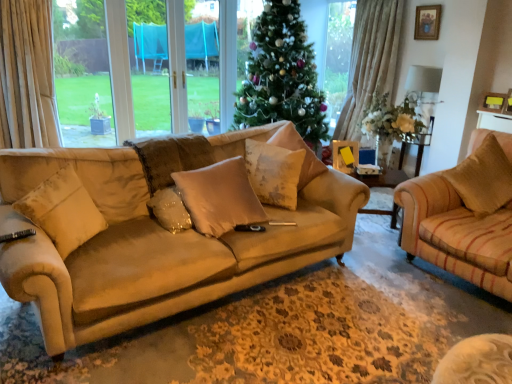
At what (x,y) coordinates should I click in order to perform the action: click on blank space above suede beige couch at center (from a real-world perspective). Please return your answer as a coordinate pair (x, y). The width and height of the screenshot is (512, 384). Looking at the image, I should click on (320, 316).